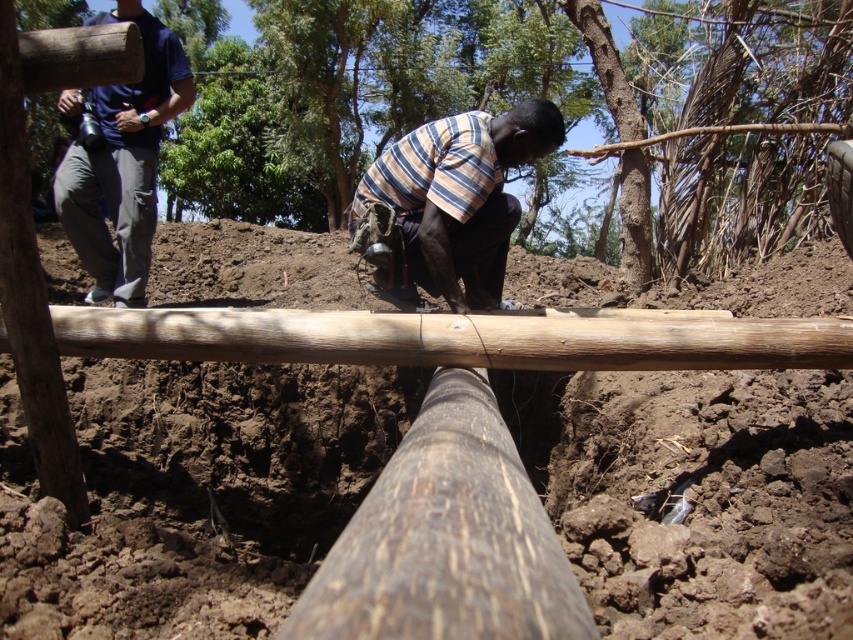
You are standing at the point with coordinates point (126,88) and want to walk to the wooden pole. There is another point at point (445,172). Which direction should you move to reach the wooden pole?

You should move forward because point (445,172) is in front of point (126,88), so moving towards that direction will lead you towards the wooden pole.

You are standing at the point marked as point [459,196] in the image. What object is directly in front of you?

The point [459,196] corresponds to the striped cotton shirt at center, so the striped cotton shirt at center is directly in front of you.